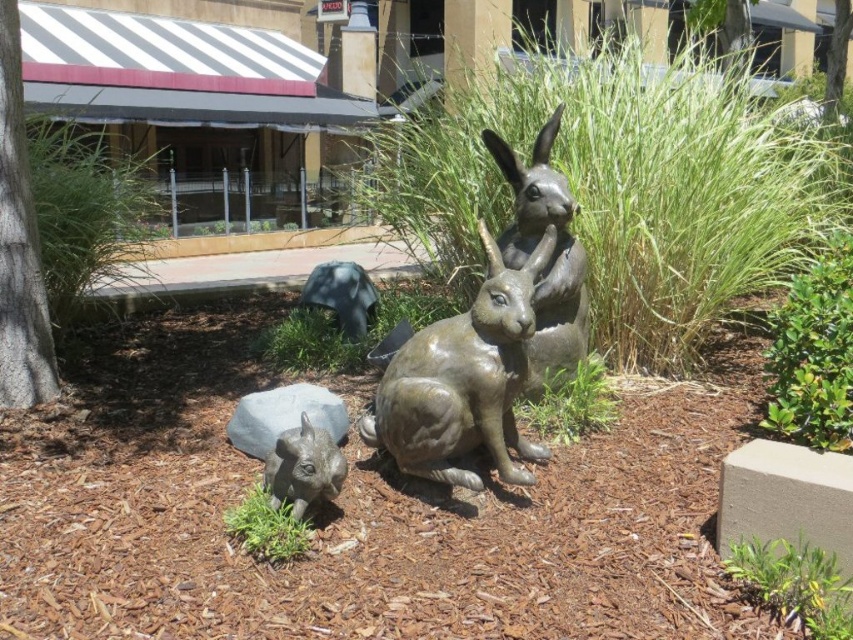
You are a landscape designer planning to place a new bench in the area. The bench is 1.2 meters wide. You see the bronze statue at center and the satin gray rabbit at lower left. Which object should you avoid placing the bench next to to ensure there is enough space?

The bronze statue at center is wider than the satin gray rabbit at lower left. To ensure enough space for the bench, you should avoid placing it next to the bronze statue at center since it occupies more width.

You are a gardener planning to place a new decorative pot that is 1.2 meters wide between the bronze rabbit at center and the bronze statue at center. Based on the scene description, will the pot fit between them?

The bronze rabbit at center is wider than the bronze statue at center. Therefore, the space between them may not accommodate a 1.2 meter wide decorative pot. Check the actual distance between them before placing the pot.

You are a landscape architect designing a garden path that needs to pass between the bronze rabbit at center and the bronze statue at center. What is the minimum width the path should be to ensure there is at least 30 inches of space between them?

The bronze rabbit at center is 25.88 inches away from bronze statue at center. Since the required distance is 30 inches, the path needs to be at least 30 inches wide. However, since the current distance is only 25.88 inches, the path cannot meet the requirement with the current spacing between the two objects.